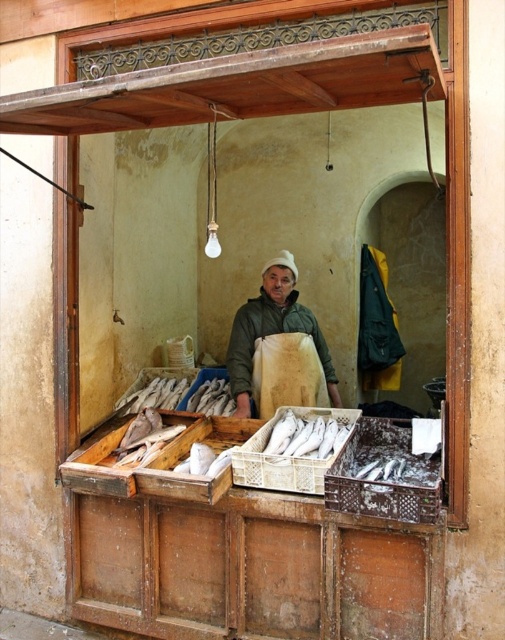
Question: Does green matte jacket at center have a greater width compared to white plastic fish at center?

Choices:
 (A) no
 (B) yes

Answer: (B)

Question: Observing the image, what is the correct spatial positioning of green matte jacket at center in reference to white plastic fish at center?

Choices:
 (A) right
 (B) left

Answer: (B)

Question: Is green matte jacket at center to the left of white plastic fish at center from the viewer's perspective?

Choices:
 (A) yes
 (B) no

Answer: (A)

Question: Which point is closer to the camera taking this photo?

Choices:
 (A) (263, 449)
 (B) (312, 312)

Answer: (A)